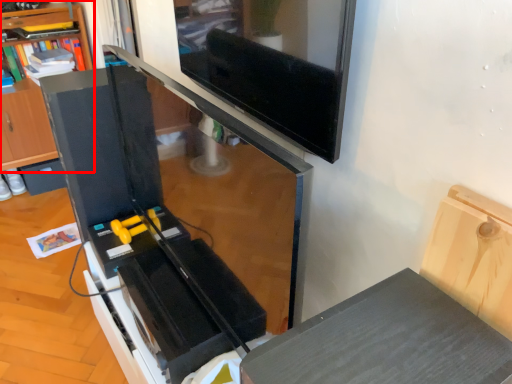
Question: In this image, where is shelf (annotated by the red box) located relative to drawer?

Choices:
 (A) left
 (B) right

Answer: (B)